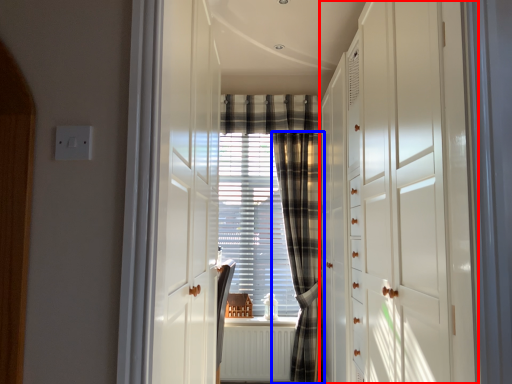
Question: Among these objects, which one is nearest to the camera, dresser (highlighted by a red box) or curtain (highlighted by a blue box)?

Choices:
 (A) dresser
 (B) curtain

Answer: (A)